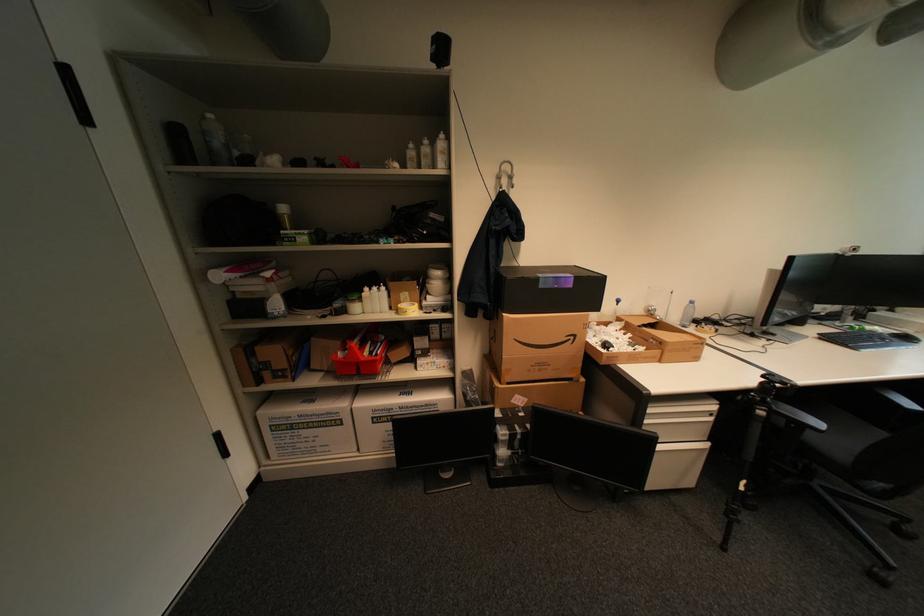
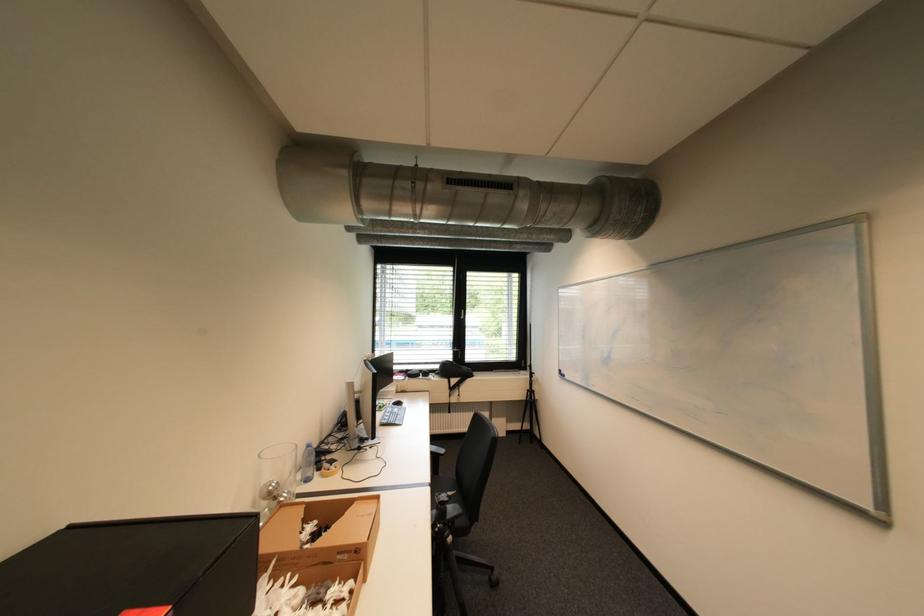
Question: Based on the continuous images, in which direction is the camera rotating? Reply with the corresponding letter.

Choices:
 (A) Left
 (B) Right
 (C) Up
 (D) Down

Answer: (B)